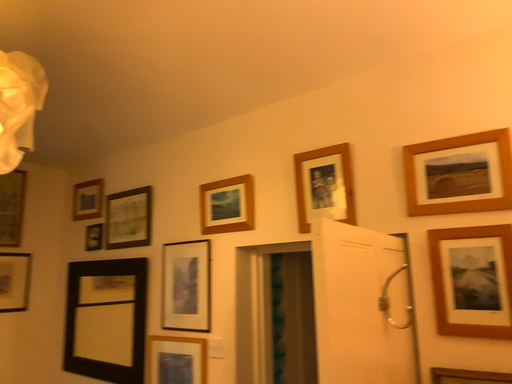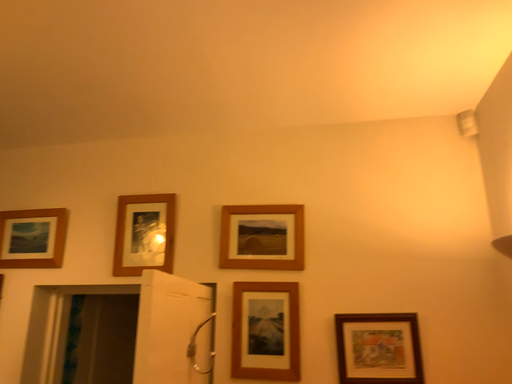
Question: How did the camera likely rotate when shooting the video?

Choices:
 (A) rotated right
 (B) rotated left

Answer: (A)